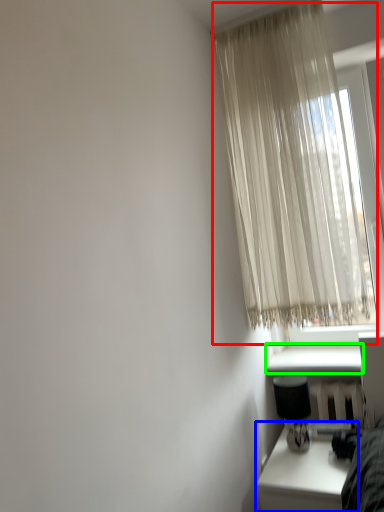
Question: Which is farther away from curtain (highlighted by a red box)? table (highlighted by a blue box) or window sill (highlighted by a green box)?

Choices:
 (A) table
 (B) window sill

Answer: (A)